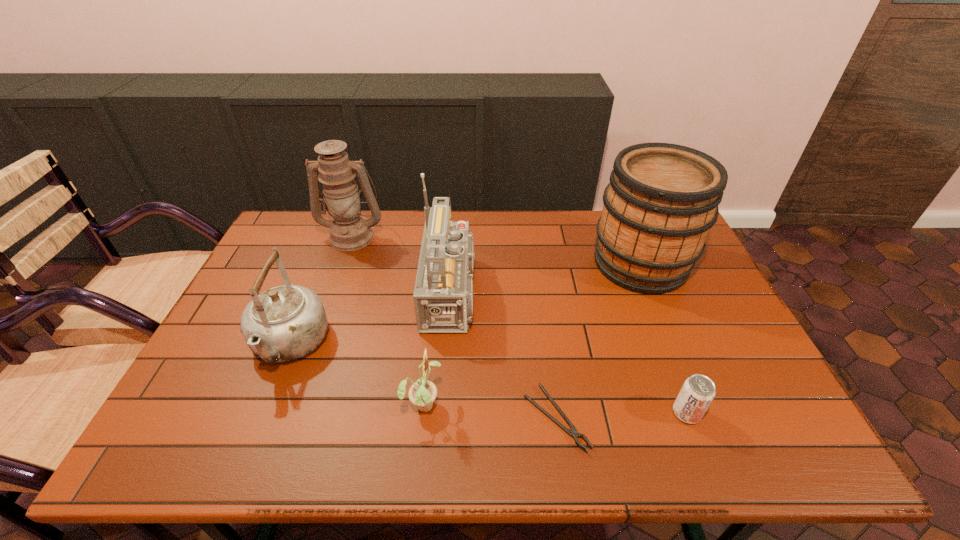
At what (x,y) coordinates should I click in order to perform the action: click on free space located 0.090m on the front-facing side of the radio receiver. Please return your answer as a coordinate pair (x, y). The image size is (960, 540). Looking at the image, I should click on (522, 293).

Identify the location of free space located at the spout of the fourth tallest object. (254, 430).

Locate an element on the screen. vacant space located on the front-facing side of the third shortest object is located at coordinates (586, 403).

Where is `vacant space located on the left of the second shortest object`? The height and width of the screenshot is (540, 960). vacant space located on the left of the second shortest object is located at coordinates (501, 413).

Find the location of a particular element. The width and height of the screenshot is (960, 540). vacant space located 0.200m on the right of the tongs is located at coordinates (673, 418).

This screenshot has width=960, height=540. What are the coordinates of `oil lamp at the far edge` in the screenshot? It's located at (349, 231).

Identify the location of cider that is positioned at the far edge. The image size is (960, 540). (662, 199).

Locate an element on the screen. The height and width of the screenshot is (540, 960). soda can at the near edge is located at coordinates (698, 391).

Locate an element on the screen. tongs that is at the near edge is located at coordinates (573, 432).

The height and width of the screenshot is (540, 960). In order to click on oil lamp positioned at the left edge in this screenshot , I will do click(x=349, y=231).